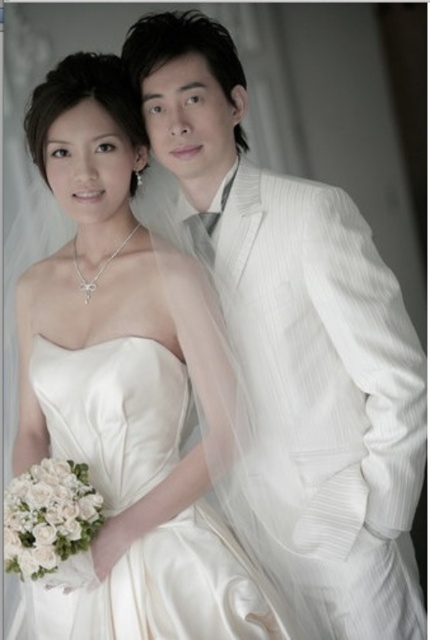
In the wedding portrait, both the white pinstripe suit at center and the satin dress at center are visible. Which of these two items takes up more space in the image?

The satin dress at center takes up more space than the white pinstripe suit at center.

You are a photographer setting up for a couple portrait. You have a backdrop that is 1.8 meters wide. The couple is standing side by side. If the white pinstripe suit at center and the satin dress at center are both facing forward, will the backdrop be wide enough to cover them without any part of their attire showing beyond the edges?

The white pinstripe suit at center might be wider than the satin dress at center, but since the total width of both together is unknown, it is uncertain if the 1.8 meter backdrop will be sufficient. Check the combined width of both outfits to confirm.

In the wedding portrait, where is the white pinstripe suit at center in relation to the satin dress at center?

The white pinstripe suit at center is to the right of the satin dress at center.